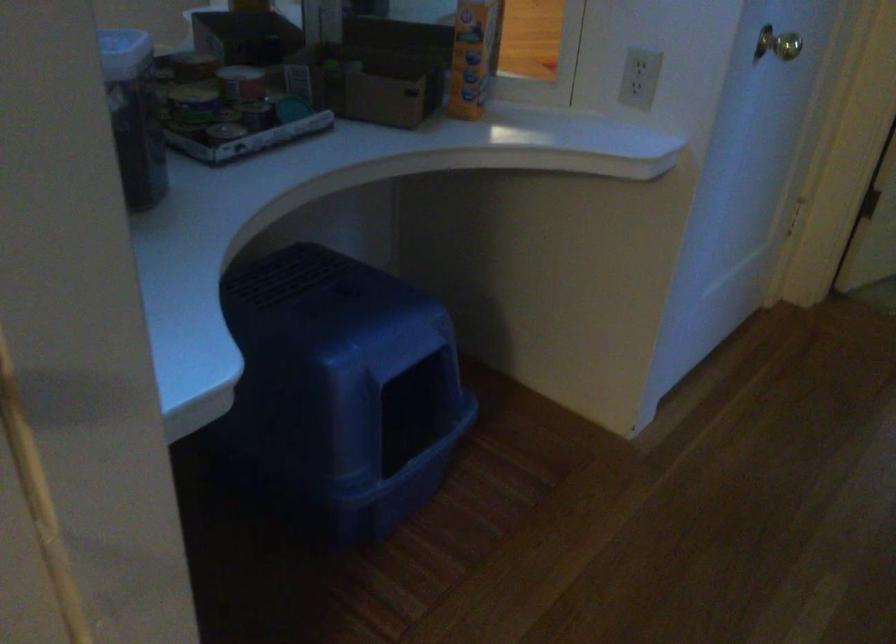
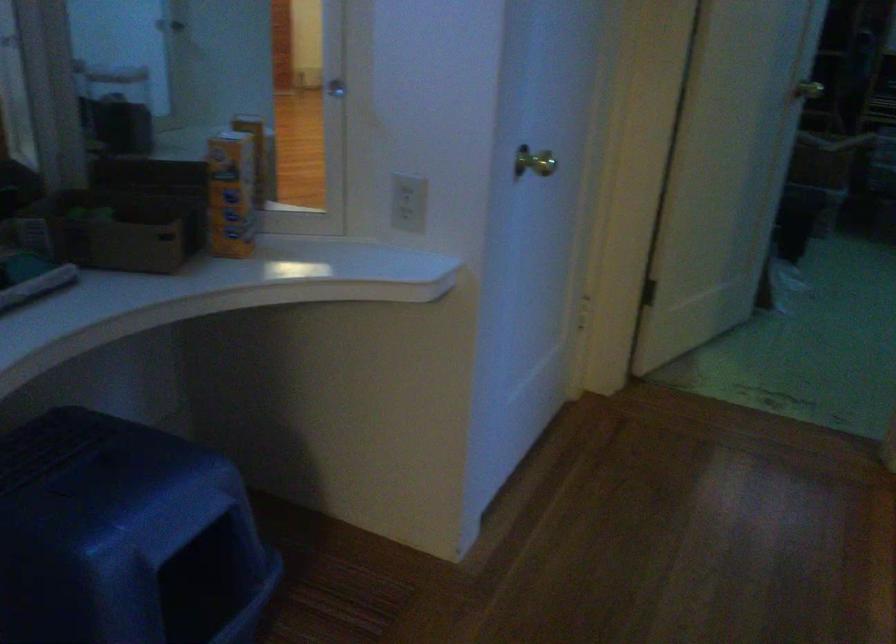
In the second image, find the point that corresponds to (x=636, y=78) in the first image.

(409, 202)